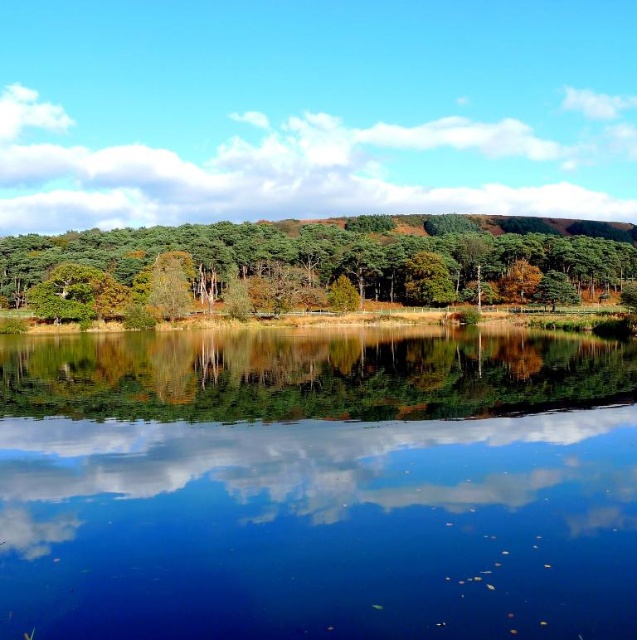
You are an artist trying to paint the scene. You notice the white fluffy cloud at upper center and the green matte tree at center. Which one has a greater width in the image?

The white fluffy cloud at upper center has a greater width than the green matte tree at center.

You are an artist trying to paint the scene. You want to ensure the transparent glass water at center and the white fluffy cloud at upper center are proportionally accurate. Which object should you paint first if you want to start with the smaller one?

The transparent glass water at center is smaller than the white fluffy cloud at upper center, so you should paint the transparent glass water at center first.

Looking at this image, you are standing at the edge of a serene lake and want to reach a specific point marked as point (145,509). If your boat can travel 20 meters before needing to refuel, will you be able to reach that point without refueling?

The distance between point (145,509) and the viewer is 16.94 meters. Since the boat can travel 20 meters before needing to refuel, you can reach the point without refueling.